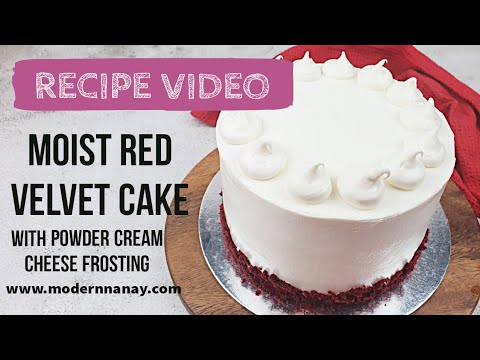
Locate an element on the screen. light reflecting on metal cake plate is located at coordinates (390, 305), (255, 297).